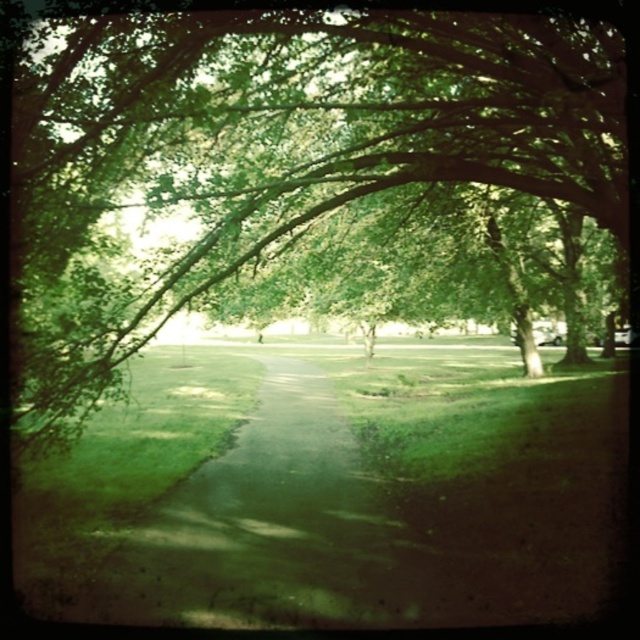
Is green leafy tree at center smaller than green grassy path at center?

Yes.

At what (x,y) coordinates should I click in order to perform the action: click on green leafy tree at center. Please return your answer as a coordinate pair (x, y). Image resolution: width=640 pixels, height=640 pixels. Looking at the image, I should click on (282, 147).